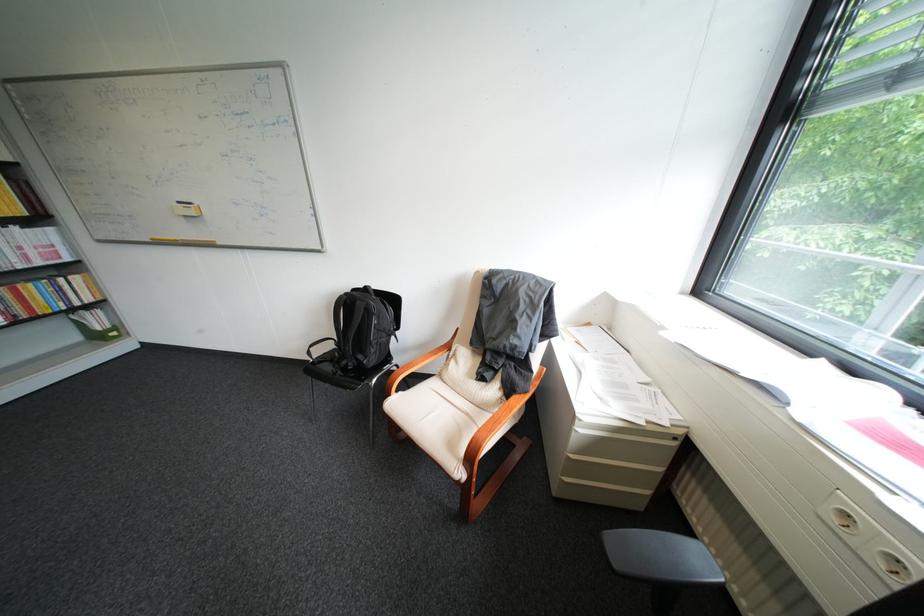
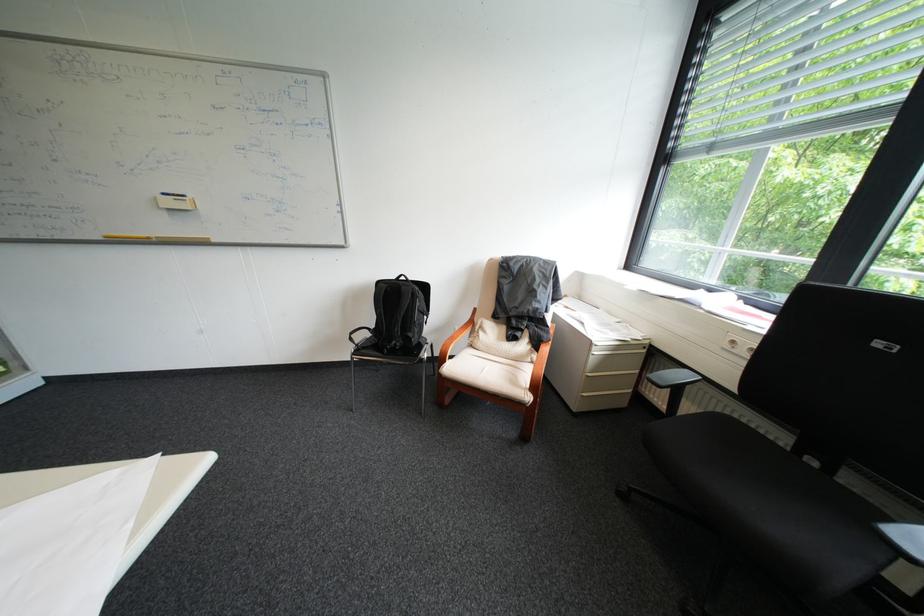
Where in the second image is the point corresponding to point (370, 302) from the first image?

(415, 288)